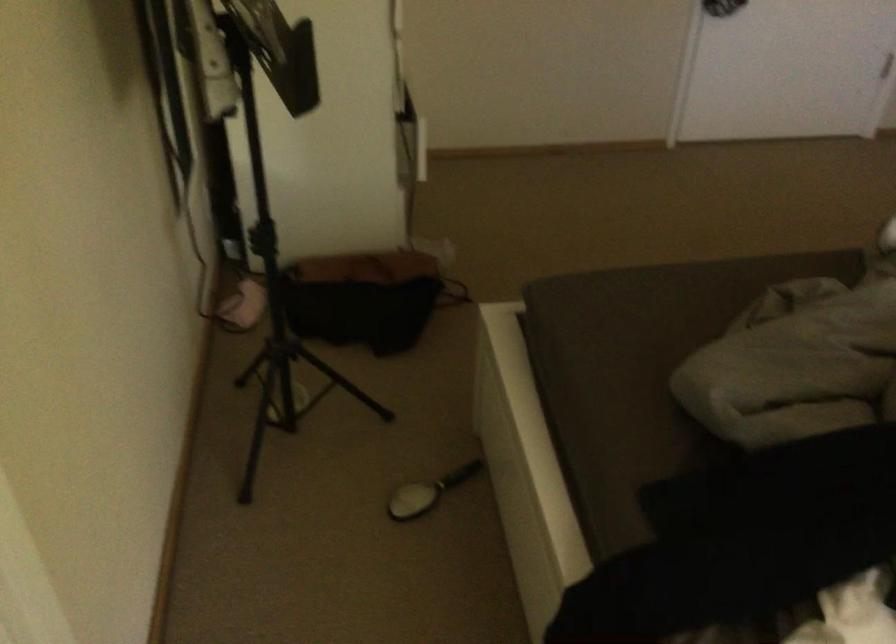
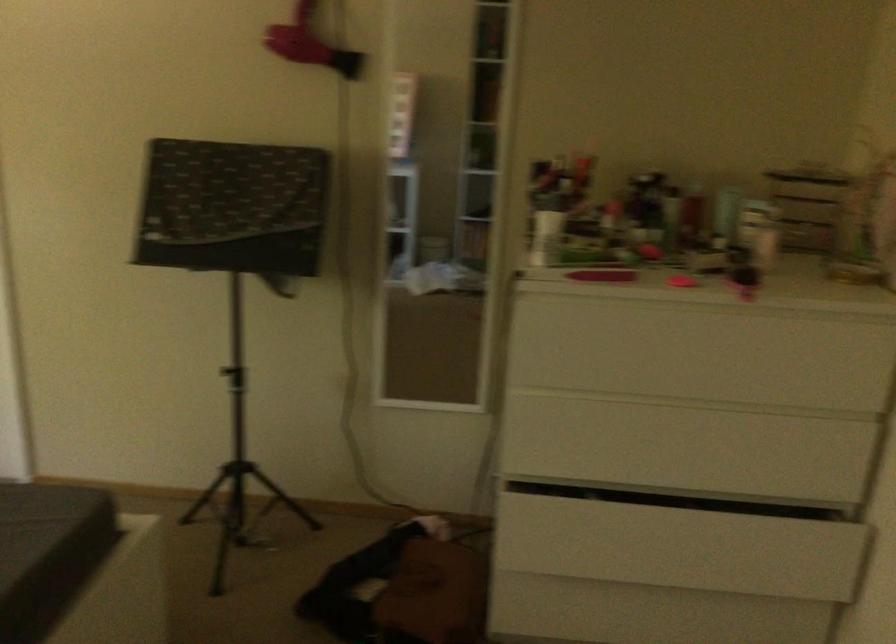
In the second image, find the point that corresponds to point 423,242 in the first image.

(435, 589)